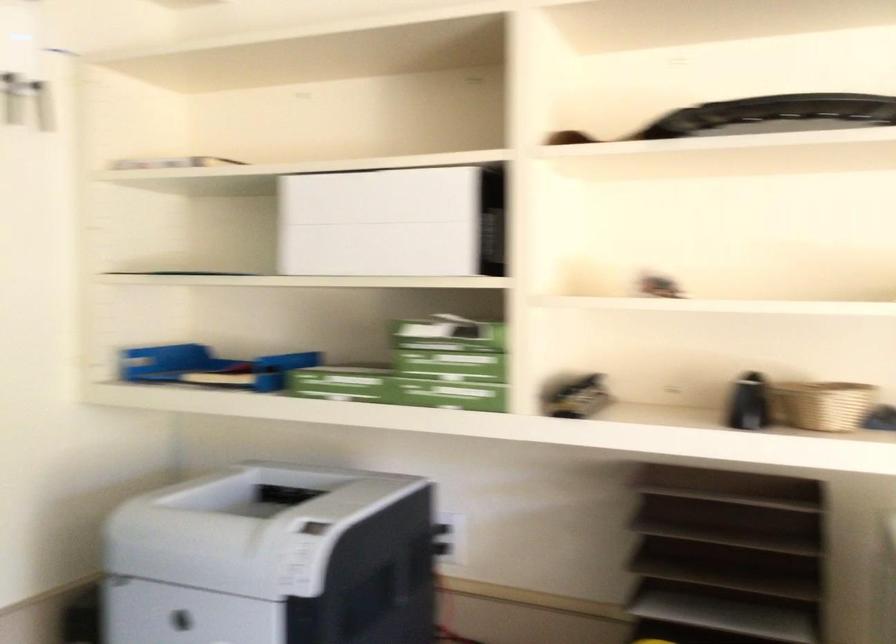
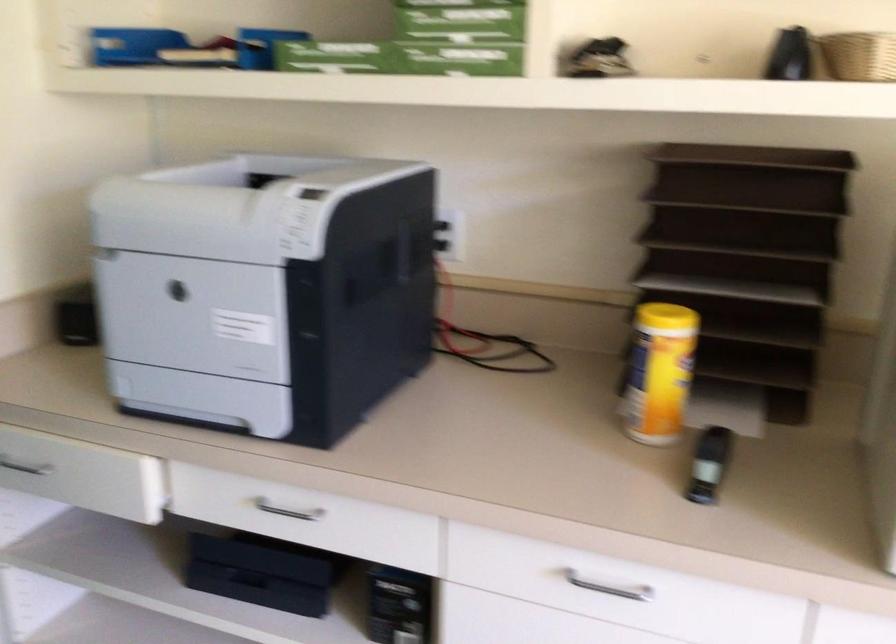
Locate, in the second image, the point that corresponds to [812,409] in the first image.

(858, 55)